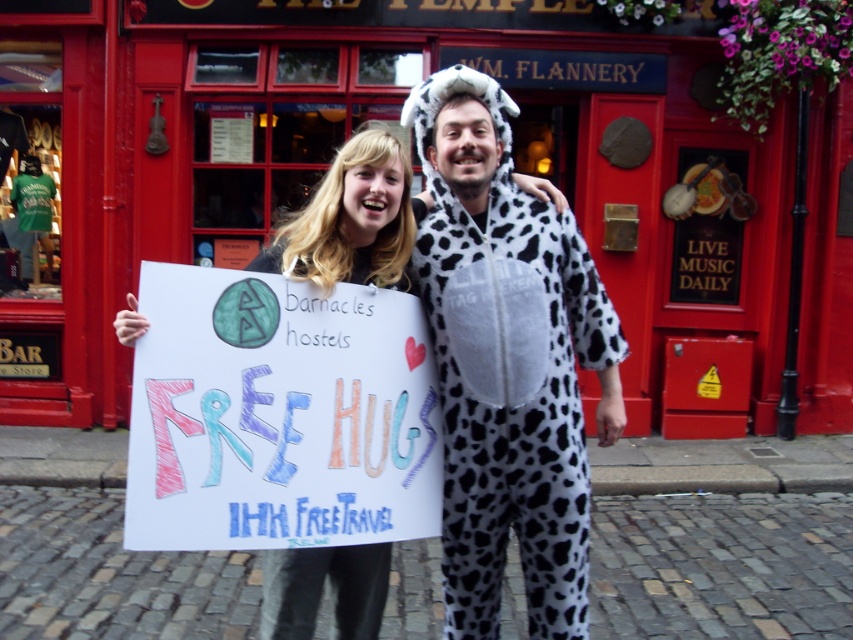
Does white-spotted costume at center have a lesser width compared to spotted fleece onesie at center?

No.

Is point (534, 314) less distant than point (450, 593)?

Yes, it is in front of point (450, 593).

Where is `white-spotted costume at center`? The height and width of the screenshot is (640, 853). white-spotted costume at center is located at coordinates (508, 364).

Who is more forward, (546, 477) or (283, 580)?

Point (546, 477)

Image resolution: width=853 pixels, height=640 pixels. Find the location of `spotted fleece onesie at center`. spotted fleece onesie at center is located at coordinates (508, 364).

You are a GUI agent. You are given a task and a screenshot of the screen. Output one action in this format:
    pyautogui.click(x=<x>, y=<y>)
    Task: Click on the spotted fleece onesie at center
    This screenshot has width=853, height=640.
    Given the screenshot: What is the action you would take?
    click(508, 364)

Based on the photo, who is shorter, white-spotted costume at center or white-spotted fabric costume at center?

white-spotted fabric costume at center is shorter.

Does white-spotted costume at center appear over white-spotted fabric costume at center?

Correct, white-spotted costume at center is located above white-spotted fabric costume at center.

Is point (537, 515) in front of point (409, 273)?

No, it is not.

Locate an element on the screen. Image resolution: width=853 pixels, height=640 pixels. white-spotted costume at center is located at coordinates (508, 364).